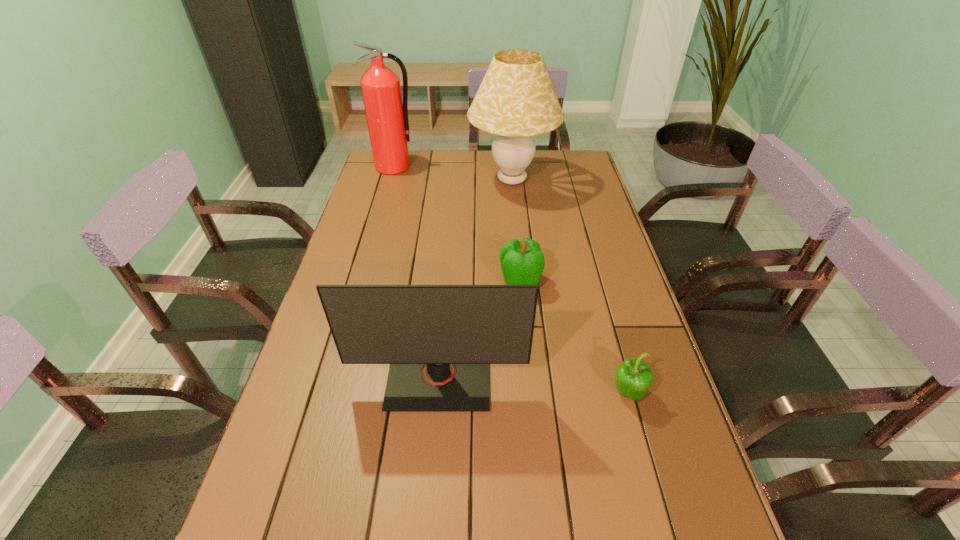
Where is `vacant point located between the lampshade and the fire extinguisher`? vacant point located between the lampshade and the fire extinguisher is located at coordinates (453, 173).

The height and width of the screenshot is (540, 960). Identify the location of vacant area that lies between the third farthest object and the fire extinguisher. (457, 224).

Where is `object that is the third closest to the third nearest object`? The width and height of the screenshot is (960, 540). object that is the third closest to the third nearest object is located at coordinates (516, 100).

The height and width of the screenshot is (540, 960). What are the coordinates of `object that is the third closest one to the monitor` in the screenshot? It's located at (516, 100).

At what (x,y) coordinates should I click in order to perform the action: click on free space that satisfies the following two spatial constraints: 1. on the back side of the lampshade; 2. on the left side of the third farthest object. Please return your answer as a coordinate pair (x, y). Looking at the image, I should click on (511, 180).

At what (x,y) coordinates should I click in order to perform the action: click on free space in the image that satisfies the following two spatial constraints: 1. at the nozzle of the fire extinguisher; 2. on the left side of the lampshade. Please return your answer as a coordinate pair (x, y). This screenshot has height=540, width=960. Looking at the image, I should click on (390, 180).

This screenshot has height=540, width=960. What are the coordinates of `free location that satisfies the following two spatial constraints: 1. at the nozzle of the lampshade; 2. on the left side of the fire extinguisher` in the screenshot? It's located at (390, 180).

Identify the location of free space that satisfies the following two spatial constraints: 1. on the screen side of the nearer bell pepper; 2. on the left side of the third tallest object. The width and height of the screenshot is (960, 540). (438, 393).